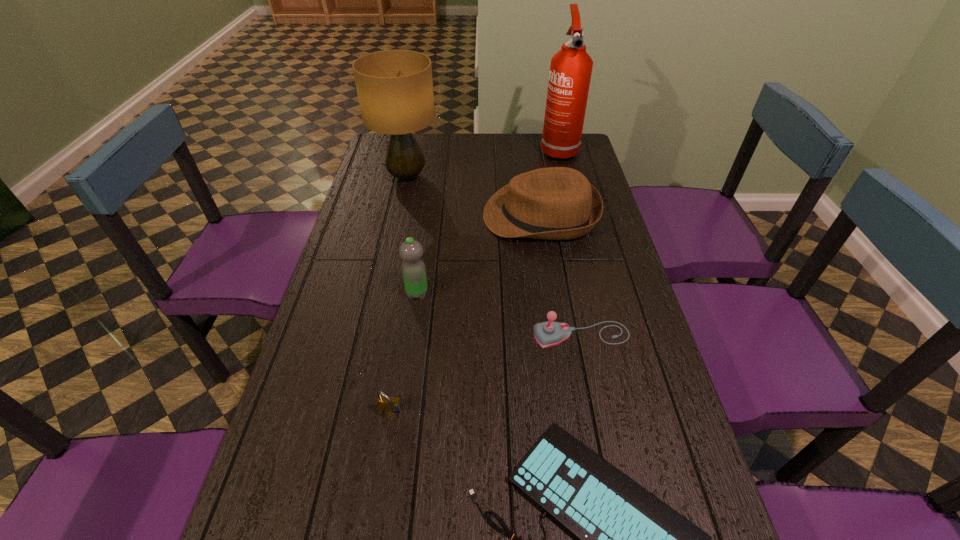
Where is `free space located on the front-facing side of the fourth shortest object`? This screenshot has height=540, width=960. free space located on the front-facing side of the fourth shortest object is located at coordinates (380, 215).

The image size is (960, 540). In order to click on free spot located 0.290m on the front-facing side of the fourth shortest object in this screenshot , I will do `click(398, 215)`.

The width and height of the screenshot is (960, 540). Identify the location of vacant space situated 0.320m on the front-facing side of the fourth shortest object. (390, 215).

The height and width of the screenshot is (540, 960). In order to click on vacant space located 0.350m on the left of the joystick in this screenshot , I will do `click(398, 335)`.

Locate an element on the screen. free spot located on the side with the combination dials of the padlock is located at coordinates (385, 455).

The height and width of the screenshot is (540, 960). I want to click on fire extinguisher that is at the far edge, so click(570, 73).

Image resolution: width=960 pixels, height=540 pixels. I want to click on lampshade at the far edge, so click(x=395, y=88).

At what (x,y) coordinates should I click in order to perform the action: click on object present at the left edge. Please return your answer as a coordinate pair (x, y). Looking at the image, I should click on (395, 88).

Identify the location of fire extinguisher that is at the right edge. (570, 73).

At what (x,y) coordinates should I click in order to perform the action: click on fedora that is at the right edge. Please return your answer as a coordinate pair (x, y). The width and height of the screenshot is (960, 540). Looking at the image, I should click on (556, 203).